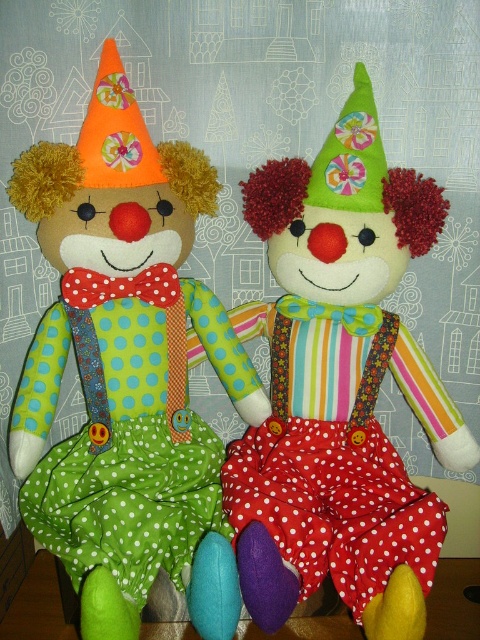
Is matte fabric clown at left taller than matte green fabric clown at center?

Yes.

Is point (84, 168) farther from viewer compared to point (444, 412)?

No.

You are a GUI agent. You are given a task and a screenshot of the screen. Output one action in this format:
    pyautogui.click(x=<x>, y=<y>)
    Task: Click on the matte fabric clown at left
    
    Given the screenshot: What is the action you would take?
    pyautogui.click(x=127, y=371)

This screenshot has height=640, width=480. In order to click on matte fabric clown at left in this screenshot , I will do `click(127, 371)`.